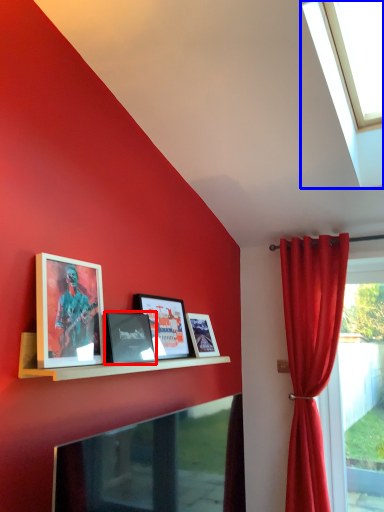
Question: Which object is closer to the camera taking this photo, picture frame (highlighted by a red box) or window (highlighted by a blue box)?

Choices:
 (A) picture frame
 (B) window

Answer: (B)